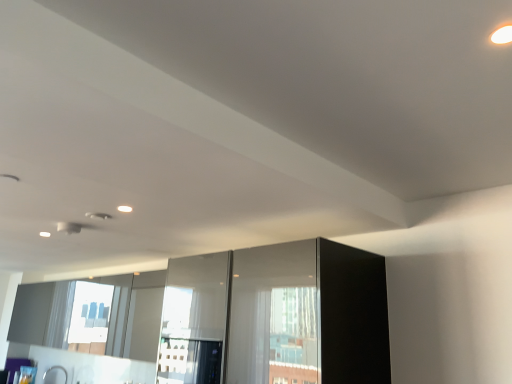
Question: Is transparent glass screen door at center, which ranks as the second screen door in right-to-left order, shorter than glossy glass screen door at center, the 1th screen door positioned from the right?

Choices:
 (A) no
 (B) yes

Answer: (A)

Question: Is transparent glass screen door at center, acting as the first screen door starting from the left, further to the viewer compared to glossy glass screen door at center, the 1th screen door positioned from the right?

Choices:
 (A) yes
 (B) no

Answer: (A)

Question: Would you say transparent glass screen door at center, acting as the first screen door starting from the left, is outside glossy glass screen door at center, the 1th screen door positioned from the right?

Choices:
 (A) yes
 (B) no

Answer: (A)

Question: Is transparent glass screen door at center, which ranks as the second screen door in right-to-left order, wider than glossy glass screen door at center, placed as the second screen door when sorted from left to right?

Choices:
 (A) yes
 (B) no

Answer: (B)

Question: Does transparent glass screen door at center, which ranks as the second screen door in right-to-left order, appear on the left side of glossy glass screen door at center, placed as the second screen door when sorted from left to right?

Choices:
 (A) yes
 (B) no

Answer: (A)

Question: From a real-world perspective, is satin nickel faucet at lower left positioned above or below glossy glass screen door at center, the 1th screen door positioned from the right?

Choices:
 (A) above
 (B) below

Answer: (B)

Question: Looking at their shapes, would you say satin nickel faucet at lower left is wider or thinner than glossy glass screen door at center, the 1th screen door positioned from the right?

Choices:
 (A) thin
 (B) wide

Answer: (A)

Question: Does point (50, 374) appear closer or farther from the camera than point (247, 253)?

Choices:
 (A) closer
 (B) farther

Answer: (B)

Question: From the image's perspective, is satin nickel faucet at lower left located above or below glossy glass screen door at center, the 1th screen door positioned from the right?

Choices:
 (A) below
 (B) above

Answer: (A)

Question: Does point (55, 369) appear closer or farther from the camera than point (202, 296)?

Choices:
 (A) closer
 (B) farther

Answer: (B)

Question: From the image's perspective, is satin nickel faucet at lower left positioned above or below transparent glass screen door at center, which ranks as the second screen door in right-to-left order?

Choices:
 (A) above
 (B) below

Answer: (B)

Question: Is satin nickel faucet at lower left situated inside transparent glass screen door at center, which ranks as the second screen door in right-to-left order, or outside?

Choices:
 (A) outside
 (B) inside

Answer: (A)

Question: Based on their positions, is satin nickel faucet at lower left located to the left or right of transparent glass screen door at center, acting as the first screen door starting from the left?

Choices:
 (A) right
 (B) left

Answer: (B)

Question: Looking at their shapes, would you say transparent glass screen door at center, which ranks as the second screen door in right-to-left order, is wider or thinner than glossy glass screen door at center, placed as the second screen door when sorted from left to right?

Choices:
 (A) wide
 (B) thin

Answer: (B)

Question: Is point (159, 372) closer or farther from the camera than point (252, 316)?

Choices:
 (A) closer
 (B) farther

Answer: (B)